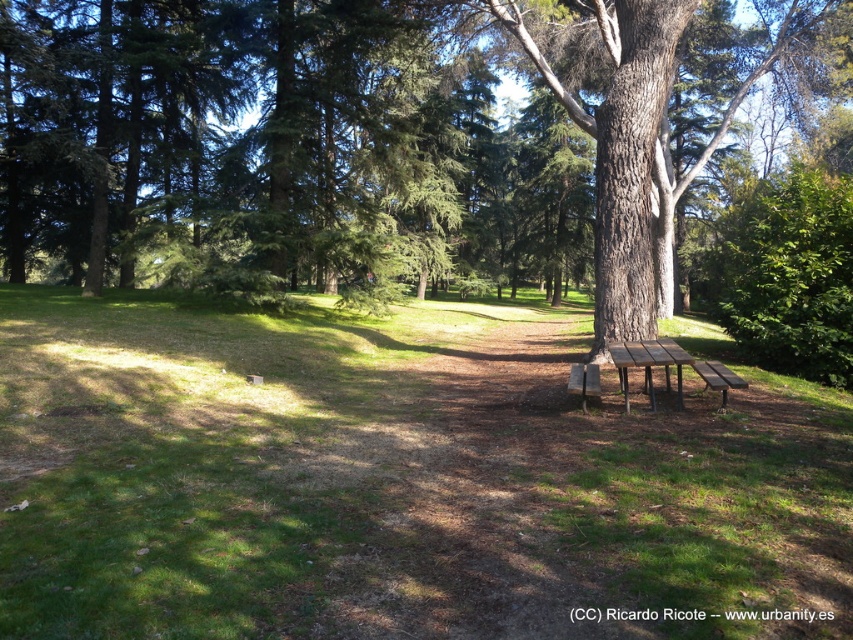
Can you confirm if brown wood tree at center is taller than wooden park bench at right?

Correct, brown wood tree at center is much taller as wooden park bench at right.

Is point (108, 88) farther from camera compared to point (724, 396)?

That is True.

Where is `brown wood tree at center`? The image size is (853, 640). brown wood tree at center is located at coordinates (434, 156).

The width and height of the screenshot is (853, 640). I want to click on wooden picnic table at lower right, so click(648, 364).

In order to click on wooden picnic table at lower right in this screenshot , I will do `click(648, 364)`.

Find the location of `wooden picnic table at lower right`. wooden picnic table at lower right is located at coordinates (648, 364).

Consider the image. Can you confirm if brown wood tree at center is smaller than wooden picnic table at lower right?

Incorrect, brown wood tree at center is not smaller in size than wooden picnic table at lower right.

Locate an element on the screen. The height and width of the screenshot is (640, 853). brown wood tree at center is located at coordinates [x=434, y=156].